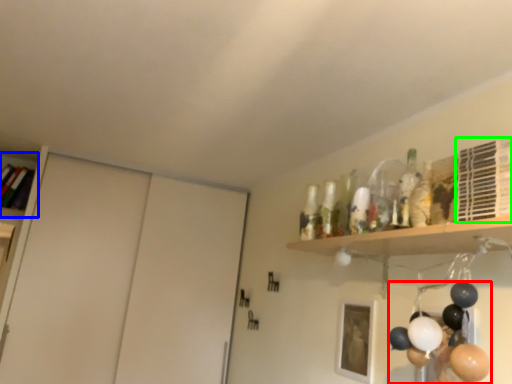
Question: Based on their relative distances, which object is nearer to balloon (highlighted by a red box)? Choose from shelf (highlighted by a blue box) and shelf (highlighted by a green box).

Choices:
 (A) shelf
 (B) shelf

Answer: (B)